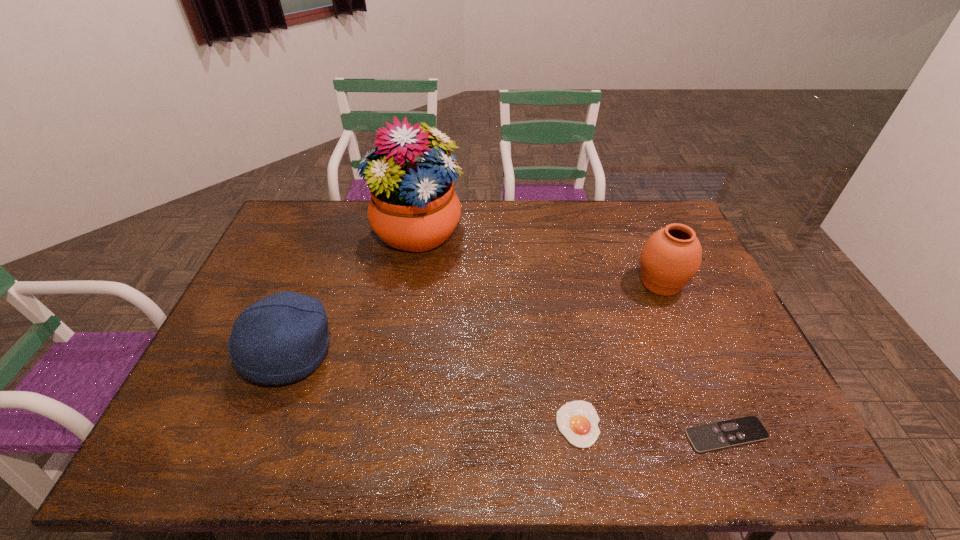
Where is `vacant space in between the remote control and the third farthest object`? The image size is (960, 540). vacant space in between the remote control and the third farthest object is located at coordinates (508, 394).

Where is `vacant point located between the tallest object and the urn`? The image size is (960, 540). vacant point located between the tallest object and the urn is located at coordinates (539, 258).

In order to click on vacant space that's between the third farthest object and the urn in this screenshot , I will do coord(475,318).

Identify the location of object that is the third nearest to the urn. click(413, 207).

You are a GUI agent. You are given a task and a screenshot of the screen. Output one action in this format:
    pyautogui.click(x=<x>, y=<y>)
    Task: Click on the fourth closest object to the flower arrangement
    Image resolution: width=960 pixels, height=540 pixels.
    Given the screenshot: What is the action you would take?
    pyautogui.click(x=738, y=431)

The width and height of the screenshot is (960, 540). Find the location of `vacant space that satisfies the following two spatial constraints: 1. on the front side of the remote control; 2. on the left side of the skullcap`. vacant space that satisfies the following two spatial constraints: 1. on the front side of the remote control; 2. on the left side of the skullcap is located at coordinates (258, 435).

This screenshot has width=960, height=540. In order to click on vacant position in the image that satisfies the following two spatial constraints: 1. on the front side of the remote control; 2. on the right side of the urn in this screenshot , I will do `click(725, 435)`.

This screenshot has height=540, width=960. Identify the location of vacant space that satisfies the following two spatial constraints: 1. on the back side of the urn; 2. on the right side of the third object from right to left. (554, 283).

You are a GUI agent. You are given a task and a screenshot of the screen. Output one action in this format:
    pyautogui.click(x=<x>, y=<y>)
    Task: Click on the vacant space that satisfies the following two spatial constraints: 1. on the front side of the remote control; 2. on the right side of the flower arrangement
    This screenshot has width=960, height=540.
    Given the screenshot: What is the action you would take?
    pyautogui.click(x=384, y=435)

This screenshot has height=540, width=960. What are the coordinates of `vacant space that satisfies the following two spatial constraints: 1. on the front side of the urn; 2. on the left side of the remote control` in the screenshot? It's located at (725, 435).